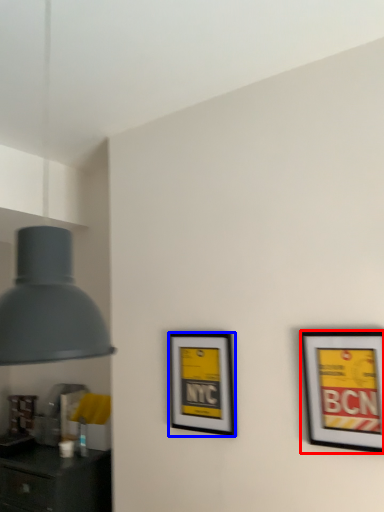
Question: Which point is closer to the camera, picture frame (highlighted by a red box) or picture frame (highlighted by a blue box)?

Choices:
 (A) picture frame
 (B) picture frame

Answer: (A)